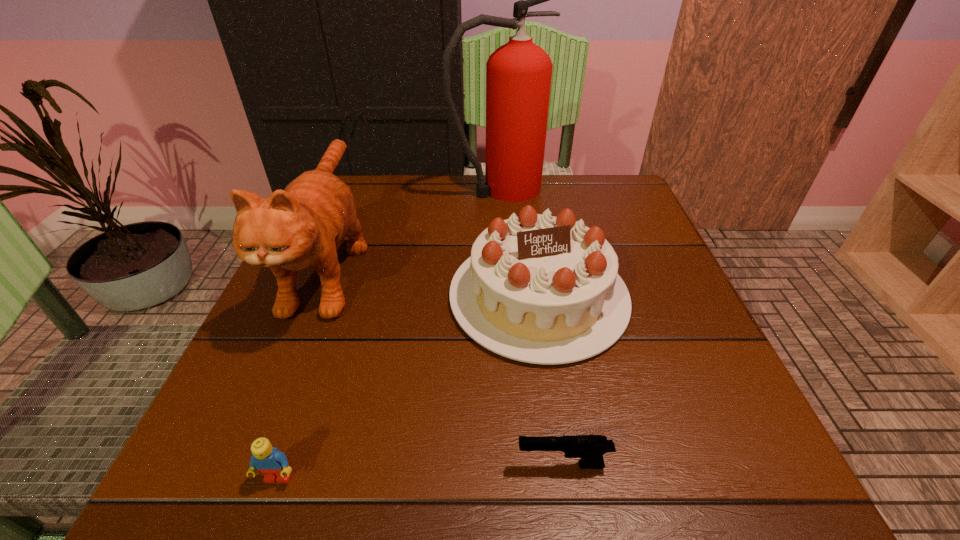
The width and height of the screenshot is (960, 540). Find the location of `vacant space that satisfies the following two spatial constraints: 1. on the face of the third tallest object; 2. on the left side of the fourth shortest object`. vacant space that satisfies the following two spatial constraints: 1. on the face of the third tallest object; 2. on the left side of the fourth shortest object is located at coordinates (317, 296).

At what (x,y) coordinates should I click in order to perform the action: click on free space that satisfies the following two spatial constraints: 1. on the handle side of the fire extinguisher; 2. on the face of the Lego. Please return your answer as a coordinate pair (x, y). Looking at the image, I should click on [x=516, y=478].

Locate an element on the screen. vacant position in the image that satisfies the following two spatial constraints: 1. on the handle side of the third shortest object; 2. on the right side of the fire extinguisher is located at coordinates (505, 296).

What are the coordinates of `vacant space that satisfies the following two spatial constraints: 1. on the face of the cat; 2. on the right side of the birthday cake` in the screenshot? It's located at (317, 296).

Where is `free space that satisfies the following two spatial constraints: 1. on the handle side of the fire extinguisher; 2. on the right side of the third shortest object`? Image resolution: width=960 pixels, height=540 pixels. free space that satisfies the following two spatial constraints: 1. on the handle side of the fire extinguisher; 2. on the right side of the third shortest object is located at coordinates (505, 296).